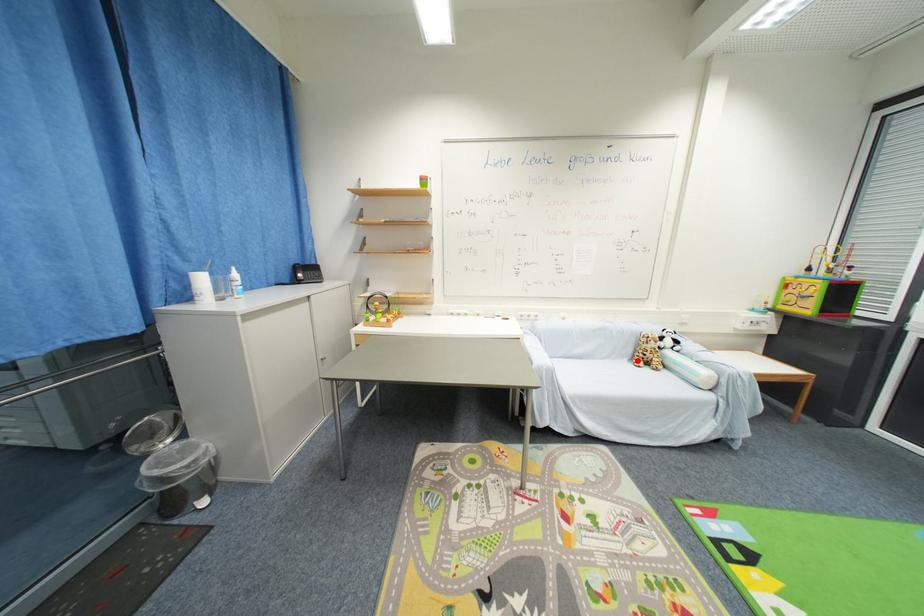
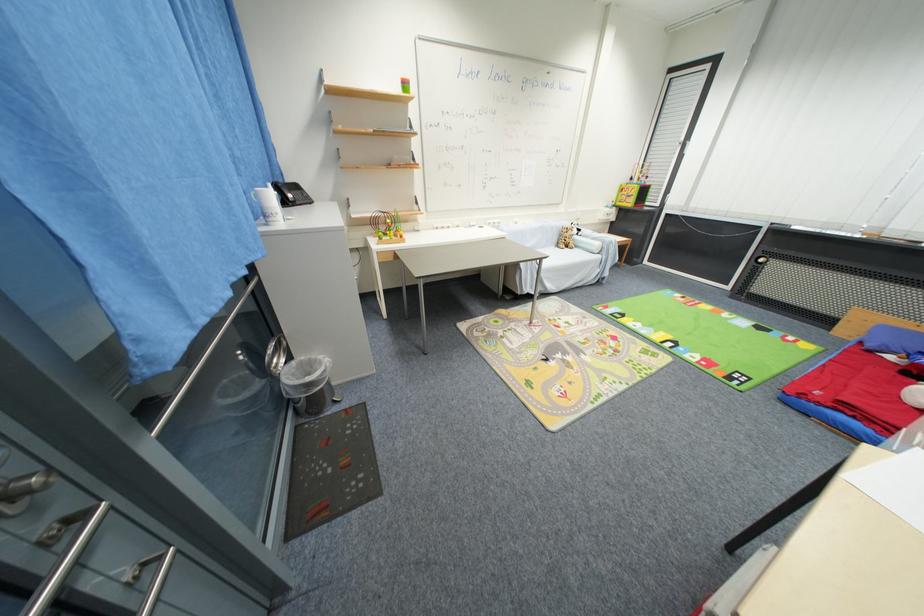
The point at the highlighted location is marked in the first image. Where is the corresponding point in the second image?

(563, 246)